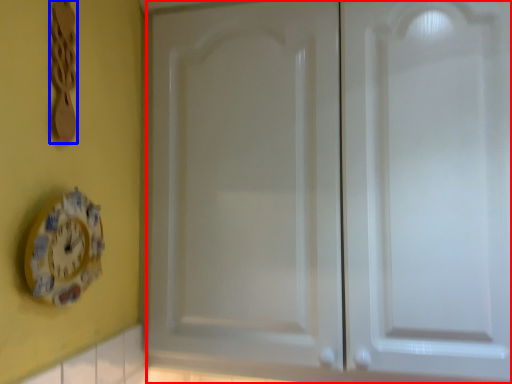
Question: Among these objects, which one is nearest to the camera, door (highlighted by a red box) or spoon (highlighted by a blue box)?

Choices:
 (A) door
 (B) spoon

Answer: (B)